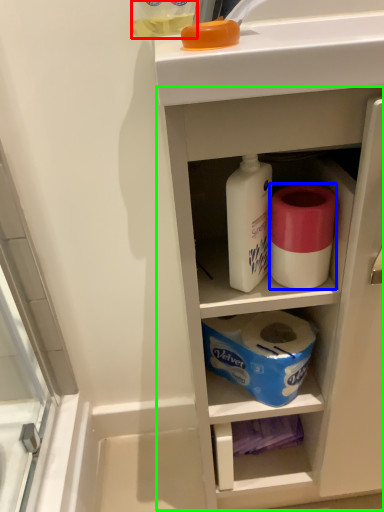
Question: Which is farther away from bottle (highlighted by a red box)? toilet paper (highlighted by a blue box) or cabinetry (highlighted by a green box)?

Choices:
 (A) toilet paper
 (B) cabinetry

Answer: (B)